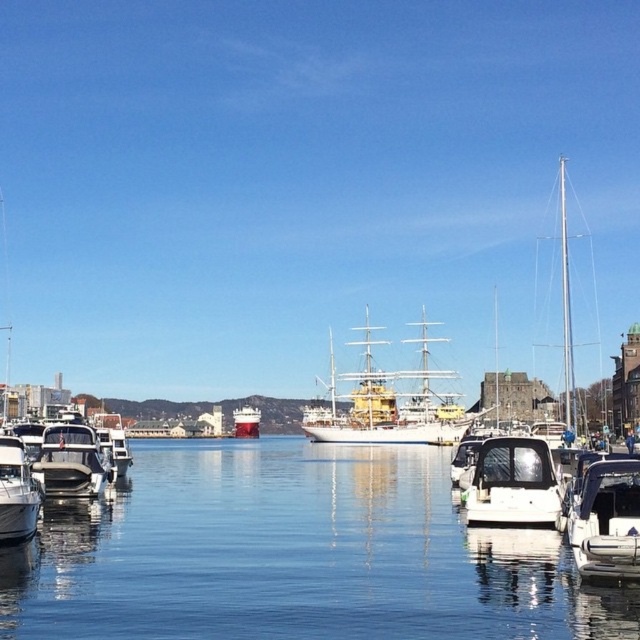
You are a dock worker who needs to move the white glossy boat at lower left and the matte black boat at left to a different dock. Which boat requires a wider space to maneuver?

The matte black boat at left requires a wider space to maneuver because its width is larger than the white glossy boat at lower left.

You are a photographer standing on the dock and want to capture both the matte black boat at left and the white glossy ship at center in your shot. Which object will appear larger in the photo?

The matte black boat at left will appear larger in the photo because it is much taller than the white glossy ship at center.

You are standing on the dock and want to take a photo of the white glossy boat at lower right. The camera you are using has a maximum focus range of 60 meters. Will you be able to capture the boat clearly in your photo?

The white glossy boat at lower right is 59.14 meters away from the camera. Since the camera can focus up to 60 meters, it is within the maximum range. Therefore, you can capture the boat clearly.